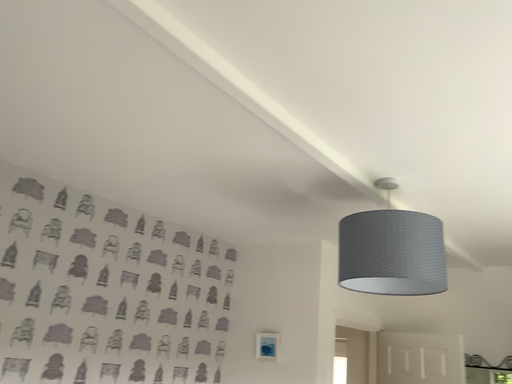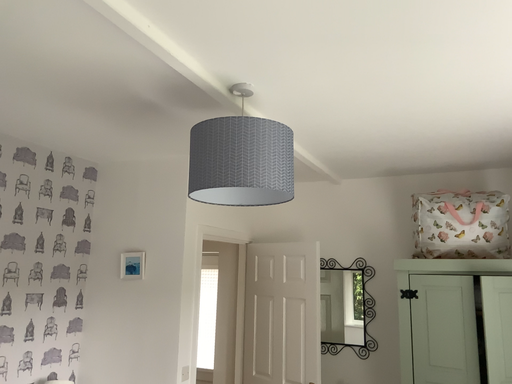
Question: How did the camera likely rotate when shooting the video?

Choices:
 (A) rotated upward
 (B) rotated downward

Answer: (B)